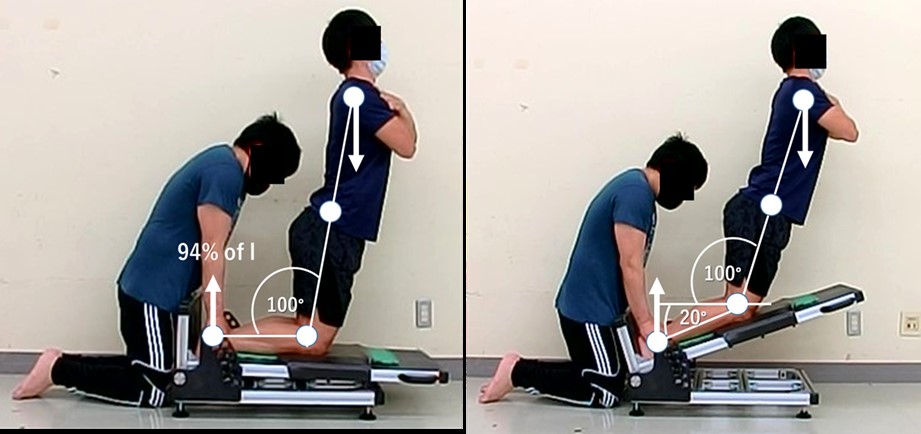
The width and height of the screenshot is (921, 434). Identify the location of electric outlet. (852, 319), (425, 318).